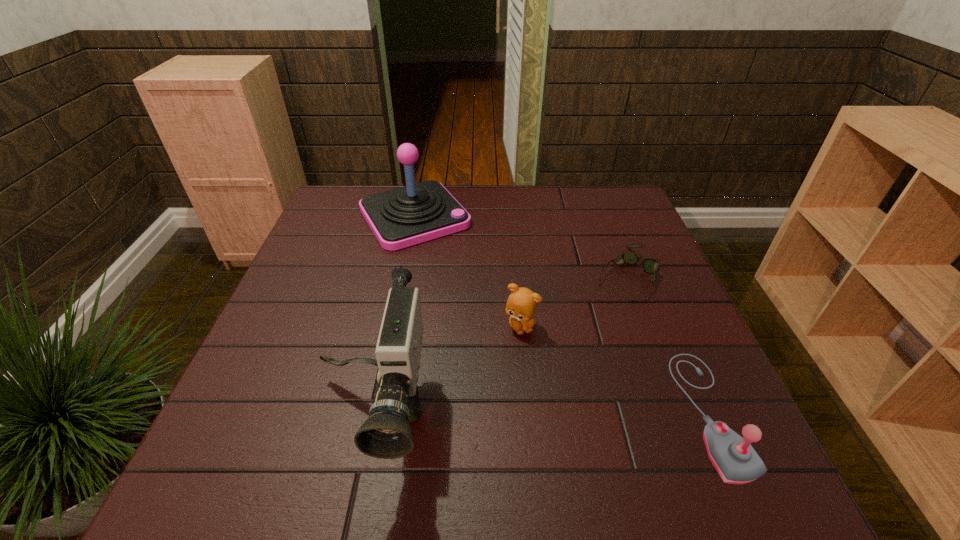
This screenshot has height=540, width=960. I want to click on free space located 0.080m forward from the base of the left joystick, so click(449, 262).

I want to click on blank space located 0.360m forward from the base of the left joystick, so click(501, 331).

At what (x,y) coordinates should I click in order to perform the action: click on blank space located forward from the base of the left joystick. Please return your answer as a coordinate pair (x, y). Looking at the image, I should click on (475, 296).

The image size is (960, 540). What are the coordinates of `vacant space located on the face of the third object from right to left` in the screenshot? It's located at (536, 355).

Locate an element on the screen. vacant space located 0.080m on the face of the third object from right to left is located at coordinates (541, 365).

This screenshot has width=960, height=540. What are the coordinates of `blank space located on the face of the third object from right to left` in the screenshot? It's located at pos(558,396).

I want to click on vacant space located 0.350m on the front-facing side of the shortest object, so click(x=527, y=384).

The width and height of the screenshot is (960, 540). In order to click on vacant space located on the front-facing side of the shortest object in this screenshot , I will do `click(598, 310)`.

I want to click on free space located 0.200m on the front-facing side of the shortest object, so click(568, 341).

This screenshot has height=540, width=960. Identify the location of object that is at the far edge. (402, 217).